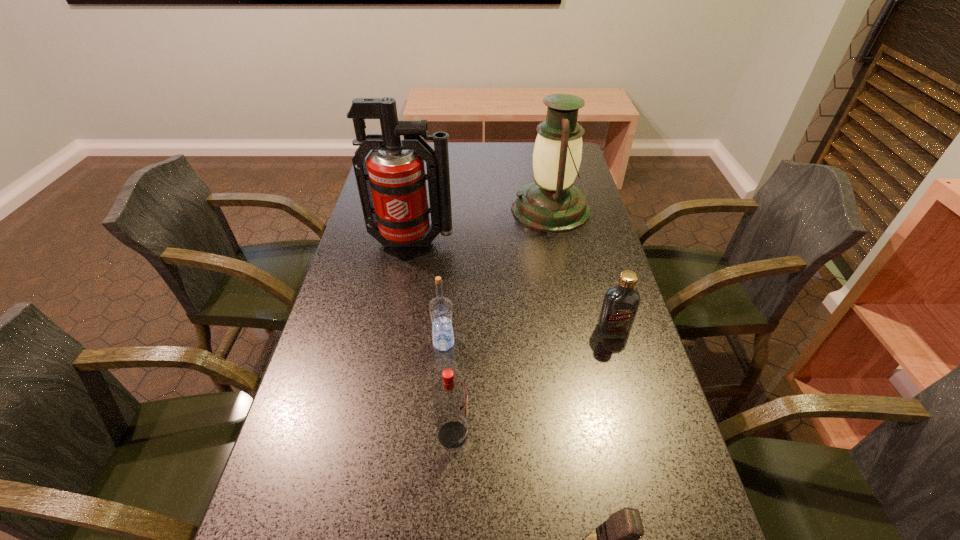
Where is `fire extinguisher`? fire extinguisher is located at coordinates (391, 182).

Locate an element on the screen. The width and height of the screenshot is (960, 540). the second tallest object is located at coordinates (551, 203).

Where is `the nearest vodka`? This screenshot has height=540, width=960. the nearest vodka is located at coordinates (450, 395).

Image resolution: width=960 pixels, height=540 pixels. What are the coordinates of `the shortest vodka` in the screenshot? It's located at (620, 305).

You are a GUI agent. You are given a task and a screenshot of the screen. Output one action in this format:
    pyautogui.click(x=<x>, y=<y>)
    Task: Click on the vacant space located 0.270m on the front label side of the fire extinguisher
    This screenshot has height=540, width=960.
    Given the screenshot: What is the action you would take?
    pyautogui.click(x=396, y=332)

I want to click on vacant position located with the light compartment facing forward on the lantern, so click(401, 209).

At what (x,y) coordinates should I click in order to perform the action: click on vacant space located 0.290m with the light compartment facing forward on the lantern. Please return your answer as a coordinate pair (x, y). Looking at the image, I should click on (422, 209).

Where is `free spot located 0.150m with the light compartment facing forward on the lantern`? Image resolution: width=960 pixels, height=540 pixels. free spot located 0.150m with the light compartment facing forward on the lantern is located at coordinates (466, 209).

The image size is (960, 540). Identify the location of free space located on the front label of the nearest vodka. (596, 435).

Where is `vacant space situated 0.090m on the front-facing side of the shortest vodka`? The width and height of the screenshot is (960, 540). vacant space situated 0.090m on the front-facing side of the shortest vodka is located at coordinates (625, 368).